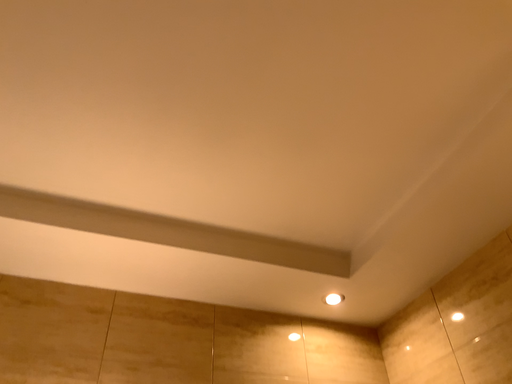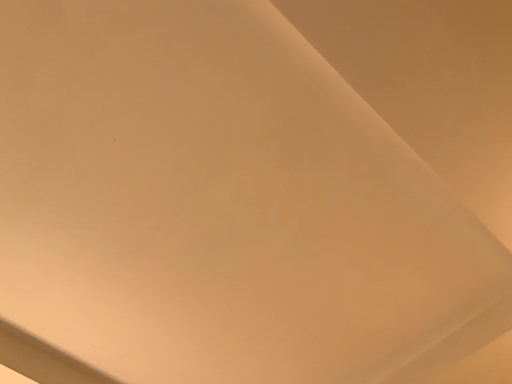
Question: Which way did the camera rotate in the video?

Choices:
 (A) rotated left
 (B) rotated right

Answer: (B)